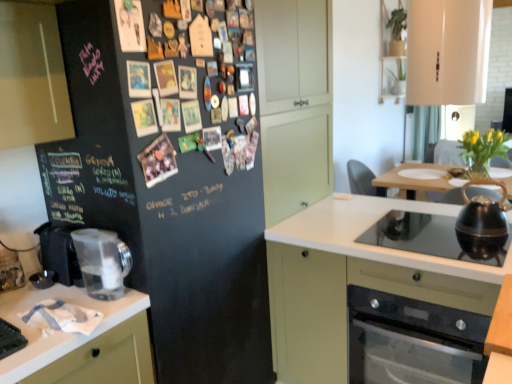
Question: Can you confirm if wooden table at lower right is wider than shiny black kettle at right, which is the second kitchen appliance in front-to-back order?

Choices:
 (A) yes
 (B) no

Answer: (B)

Question: Considering the relative positions of wooden table at lower right and shiny black kettle at right, which ranks as the second kitchen appliance in left-to-right order, in the image provided, is wooden table at lower right to the right of shiny black kettle at right, which ranks as the second kitchen appliance in left-to-right order, from the viewer's perspective?

Choices:
 (A) yes
 (B) no

Answer: (B)

Question: Is wooden table at lower right surrounding shiny black kettle at right, which is the second kitchen appliance in front-to-back order?

Choices:
 (A) no
 (B) yes

Answer: (A)

Question: Does wooden table at lower right have a larger size compared to shiny black kettle at right, which is the second kitchen appliance in front-to-back order?

Choices:
 (A) no
 (B) yes

Answer: (B)

Question: Does wooden table at lower right touch shiny black kettle at right, which ranks as the first kitchen appliance in back-to-front order?

Choices:
 (A) no
 (B) yes

Answer: (A)

Question: Is point (501, 321) positioned closer to the camera than point (480, 248)?

Choices:
 (A) closer
 (B) farther

Answer: (A)

Question: From the image's perspective, relative to shiny black kettle at right, which ranks as the first kitchen appliance in back-to-front order, is wooden table at lower right above or below?

Choices:
 (A) below
 (B) above

Answer: (A)

Question: From a real-world perspective, is wooden table at lower right physically located above or below shiny black kettle at right, which appears as the first kitchen appliance when viewed from the right?

Choices:
 (A) below
 (B) above

Answer: (A)

Question: Is wooden table at lower right situated inside shiny black kettle at right, which appears as the first kitchen appliance when viewed from the right, or outside?

Choices:
 (A) inside
 (B) outside

Answer: (B)

Question: Is black glass stove at lower right bigger or smaller than matte white cabinet at center, which is counted as the first cabinetry, starting from the bottom?

Choices:
 (A) small
 (B) big

Answer: (A)

Question: Is black glass stove at lower right wider or thinner than matte white cabinet at center, which is counted as the first cabinetry, starting from the bottom?

Choices:
 (A) wide
 (B) thin

Answer: (B)

Question: From a real-world perspective, is black glass stove at lower right physically located above or below matte white cabinet at center, which is counted as the first cabinetry, starting from the bottom?

Choices:
 (A) below
 (B) above

Answer: (A)

Question: In terms of height, does black glass stove at lower right look taller or shorter compared to matte white cabinet at center, which appears as the second cabinetry when viewed from the top?

Choices:
 (A) tall
 (B) short

Answer: (B)

Question: Is black glass stove at lower right inside the boundaries of wooden table at lower right, or outside?

Choices:
 (A) inside
 (B) outside

Answer: (B)

Question: From their relative heights in the image, would you say black glass stove at lower right is taller or shorter than wooden table at lower right?

Choices:
 (A) tall
 (B) short

Answer: (B)